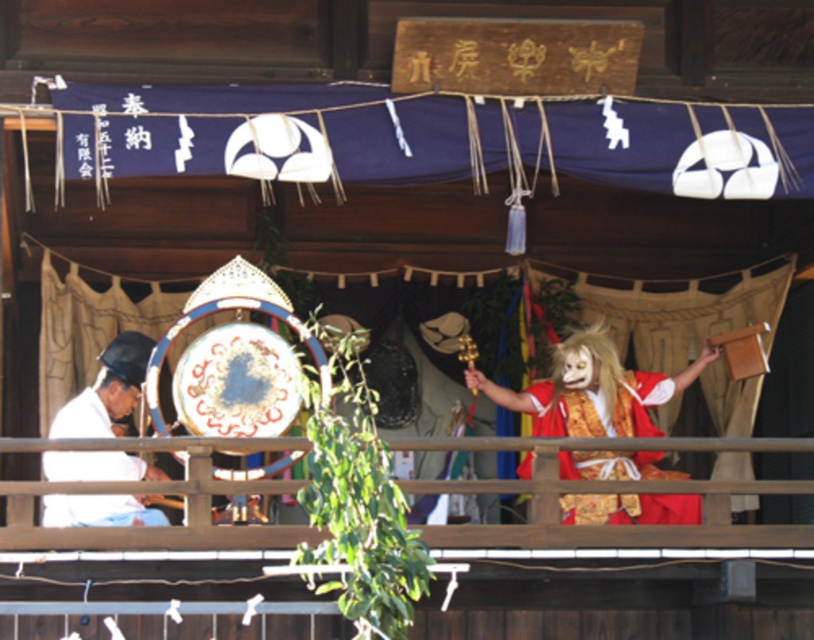
Does red satin kimono at center have a smaller size compared to white matte/soft fabric at left?

Actually, red satin kimono at center might be larger than white matte/soft fabric at left.

Does red satin kimono at center have a larger size compared to white matte/soft fabric at left?

Yes, red satin kimono at center is bigger than white matte/soft fabric at left.

Is point (567, 454) more distant than point (73, 520)?

Yes.

The width and height of the screenshot is (814, 640). Identify the location of red satin kimono at center. [596, 408].